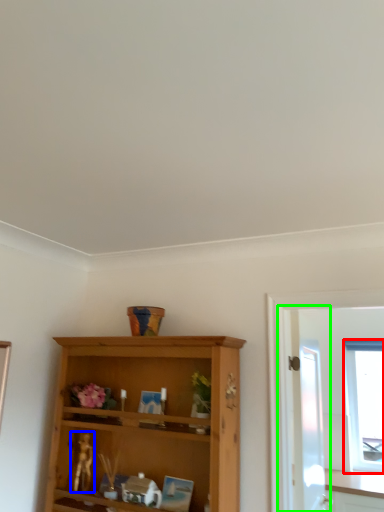
Question: Considering the real-world distances, which object is closest to window (highlighted by a red box)? miniature (highlighted by a blue box) or screen door (highlighted by a green box).

Choices:
 (A) miniature
 (B) screen door

Answer: (B)